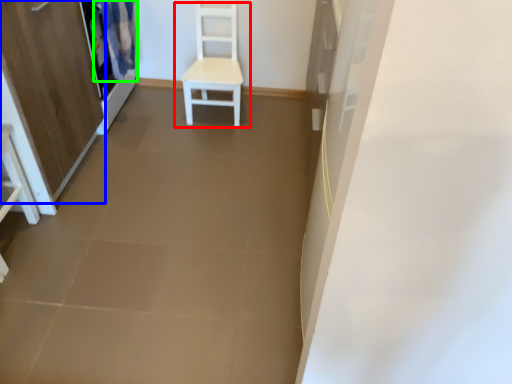
Question: Which is nearer to the chair (highlighted by a red box)? screen door (highlighted by a blue box) or curtain (highlighted by a green box).

Choices:
 (A) screen door
 (B) curtain

Answer: (B)